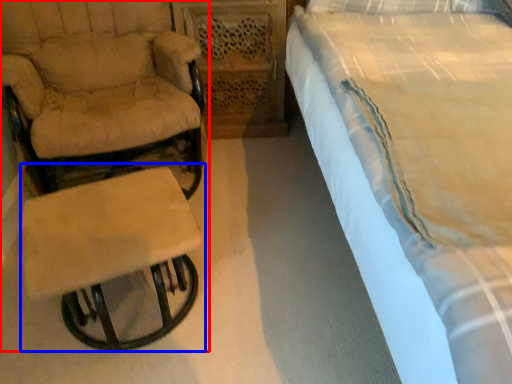
Question: Which point is further to the camera, chair (highlighted by a red box) or table (highlighted by a blue box)?

Choices:
 (A) chair
 (B) table

Answer: (A)